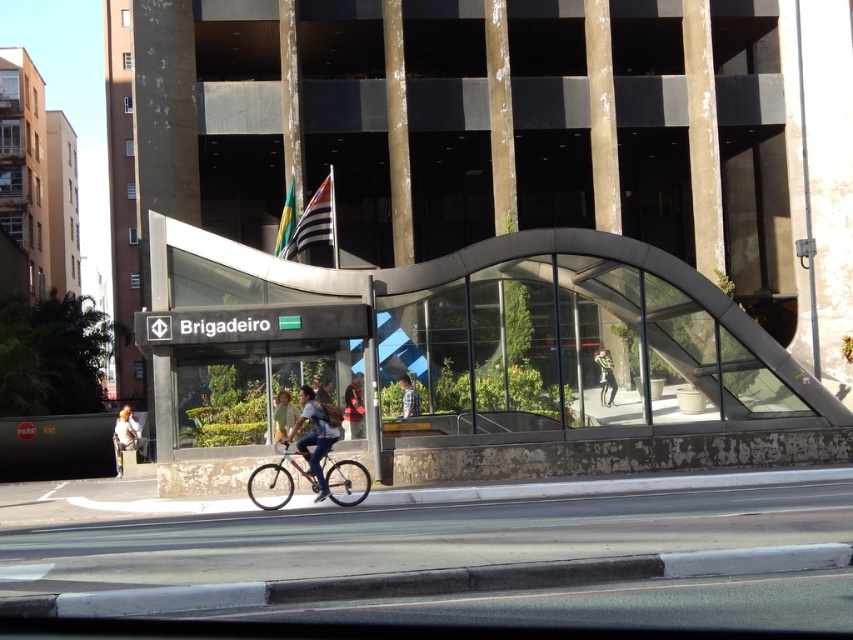
Question: Is silver metallic bicycle at center positioned before black and white striped pants at center?

Choices:
 (A) yes
 (B) no

Answer: (A)

Question: Which of these objects is positioned closest to the denim jacket at center?

Choices:
 (A) light blue jeans at center
 (B) orange fabric shirt at lower left
 (C) red fabric jacket at center

Answer: (C)

Question: Can you confirm if silver metallic bicycle at center is thinner than orange fabric shirt at lower left?

Choices:
 (A) no
 (B) yes

Answer: (B)

Question: Does silver metallic bicycle at center have a lesser width compared to denim jacket at center?

Choices:
 (A) no
 (B) yes

Answer: (A)

Question: Which point is farther to the camera?

Choices:
 (A) orange fabric shirt at lower left
 (B) light brown leather jacket at center
 (C) silver metallic bicycle at center
 (D) black and white striped pants at center

Answer: (A)

Question: Among these objects, which one is nearest to the camera?

Choices:
 (A) light brown leather jacket at center
 (B) denim jacket at center
 (C) silver metallic bicycle at center
 (D) orange fabric shirt at lower left

Answer: (C)